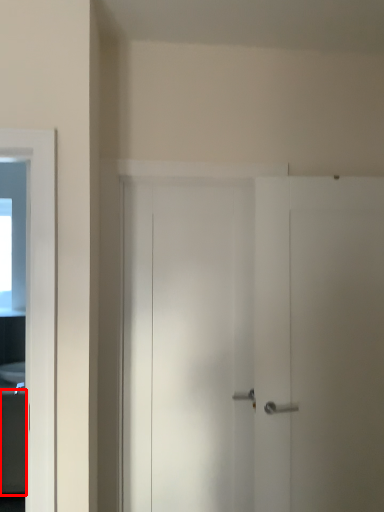
Question: From the image's perspective, where is cabinetry (annotated by the red box) located relative to sink?

Choices:
 (A) above
 (B) below

Answer: (B)